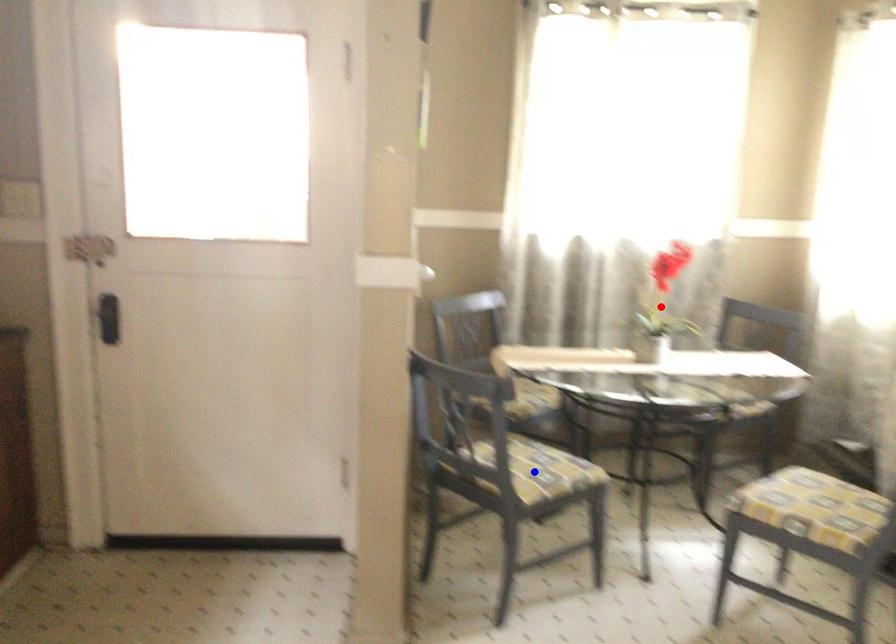
Question: Which of the two points in the image is closer to the camera?

Choices:
 (A) Blue point is closer.
 (B) Red point is closer.

Answer: (A)